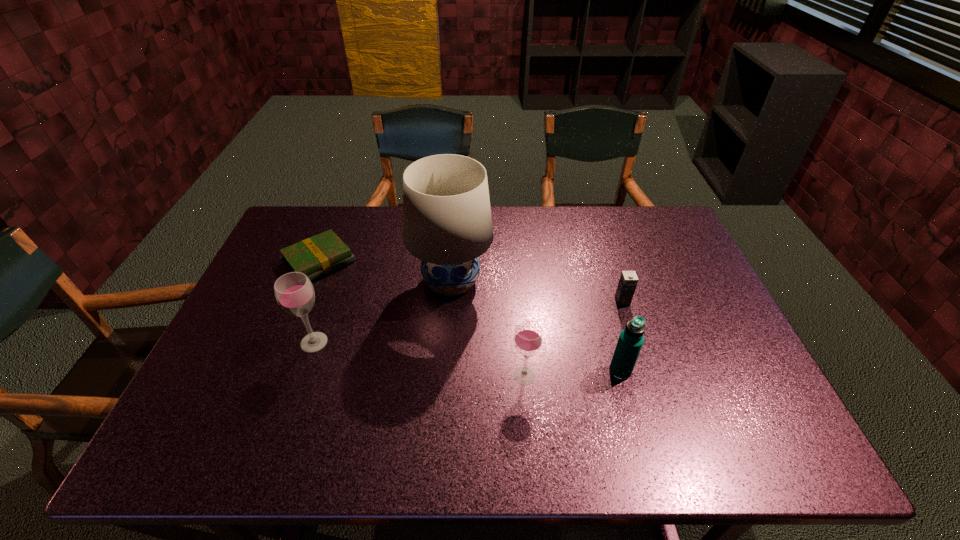
Where is `free region located 0.250m on the back of the fifth shortest object`? free region located 0.250m on the back of the fifth shortest object is located at coordinates (340, 267).

The height and width of the screenshot is (540, 960). Identify the location of free region located 0.350m on the left of the right wineglass. (366, 376).

This screenshot has height=540, width=960. What are the coordinates of `vacant space situated 0.170m on the front label of the rightmost object` in the screenshot? It's located at (639, 355).

Find the location of a particular element. This screenshot has width=960, height=540. vacant space located 0.100m on the front-facing side of the fourth object from right to left is located at coordinates (447, 341).

The image size is (960, 540). I want to click on free spot located 0.180m on the back of the book, so click(341, 208).

I want to click on vacant position located 0.130m on the back of the fifth object from left to right, so click(x=607, y=322).

Find the location of `object at the far edge`. object at the far edge is located at coordinates (316, 256).

This screenshot has width=960, height=540. I want to click on object that is at the near edge, so pos(528,338).

Locate an element on the screen. The width and height of the screenshot is (960, 540). object situated at the left edge is located at coordinates (316, 256).

I want to click on object that is at the far left corner, so click(316, 256).